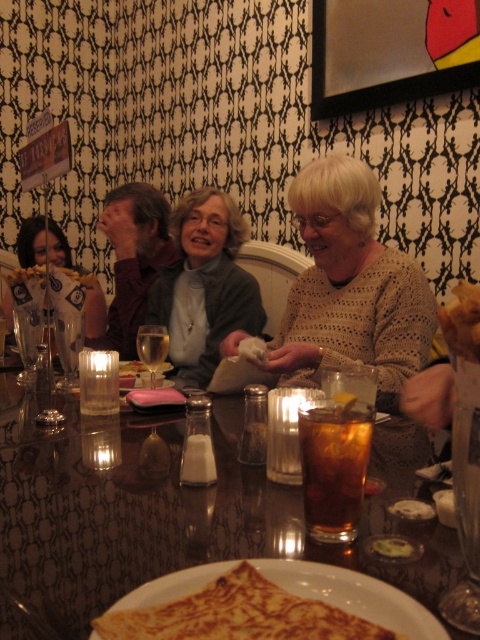
You are a server in a restaurant and need to place a new drink order on the table. Considering the height of the shiny glass table at center and the knitted beige sweater at center, which object is shorter and therefore safer to place the drink on without blocking the view?

The shiny glass table at center is not as tall as the knitted beige sweater at center, so placing the drink on the shiny glass table at center would be safer as it is shorter and less likely to block the view.

You are a waiter in a restaurant. You need to place a new drink order for the customer whose knitted beige sweater at center is visible. Where should you place the drink in relation to the translucent glass at table center?

The knitted beige sweater at center is located above the translucent glass at table center, so you should place the drink next to the translucent glass at table center, not directly under the sweater since it is already above it.

You are a server in a restaurant. You need to place a 16.5 inch long decorative plate between the knitted beige sweater at center and the translucent glass at table center. Will the plate fit in the space between them?

The distance between the knitted beige sweater at center and the translucent glass at table center is 16.62 inches. Since the plate is 16.5 inches long, it will fit with a small amount of space remaining.